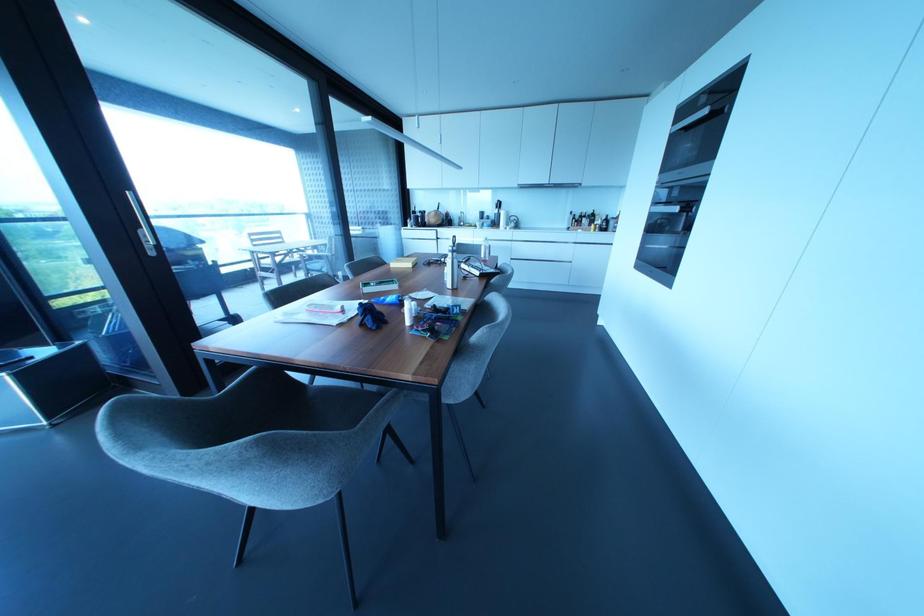
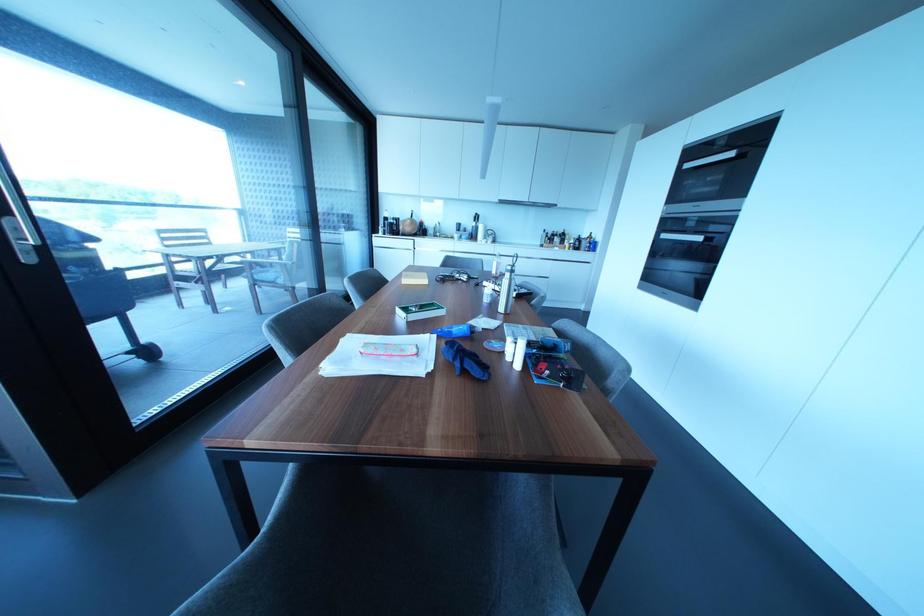
The images are taken continuously from a first-person perspective. In which direction are you moving?

The cameraman walked toward left, forward.